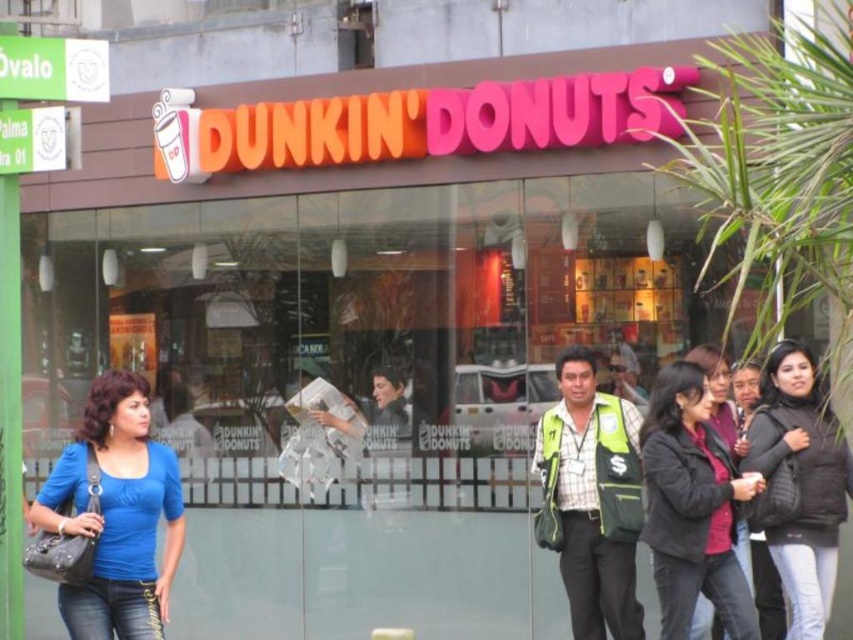
Question: Which point appears closest to the camera in this image?

Choices:
 (A) (106, 618)
 (B) (670, 452)
 (C) (358, 596)
 (D) (782, 547)

Answer: (A)

Question: Does smooth concrete pavement at lower center appear over dark brown leather jacket at center?

Choices:
 (A) no
 (B) yes

Answer: (A)

Question: Which point is closer to the camera?

Choices:
 (A) (32, 616)
 (B) (653, 426)

Answer: (B)

Question: Is smooth concrete pavement at lower center below black matte jacket at lower right?

Choices:
 (A) no
 (B) yes

Answer: (B)

Question: Is smooth concrete pavement at lower center wider than dark brown leather jacket at center?

Choices:
 (A) yes
 (B) no

Answer: (A)

Question: Among these objects, which one is farthest from the camera?

Choices:
 (A) blue fabric shirt at lower left
 (B) black matte jacket at lower right
 (C) smooth concrete pavement at lower center
 (D) dark brown leather jacket at center

Answer: (C)